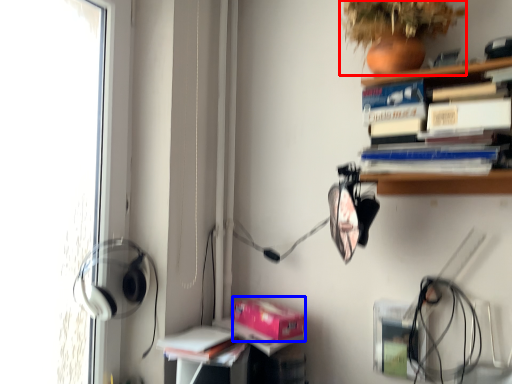
Question: Which object is closer to the camera taking this photo, plant (highlighted by a red box) or paperback book (highlighted by a blue box)?

Choices:
 (A) plant
 (B) paperback book

Answer: (A)